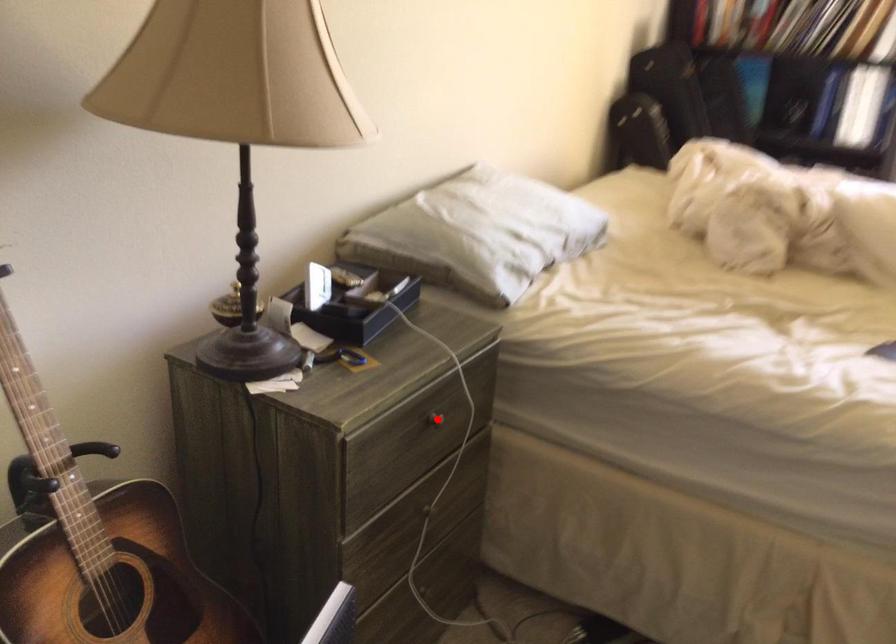
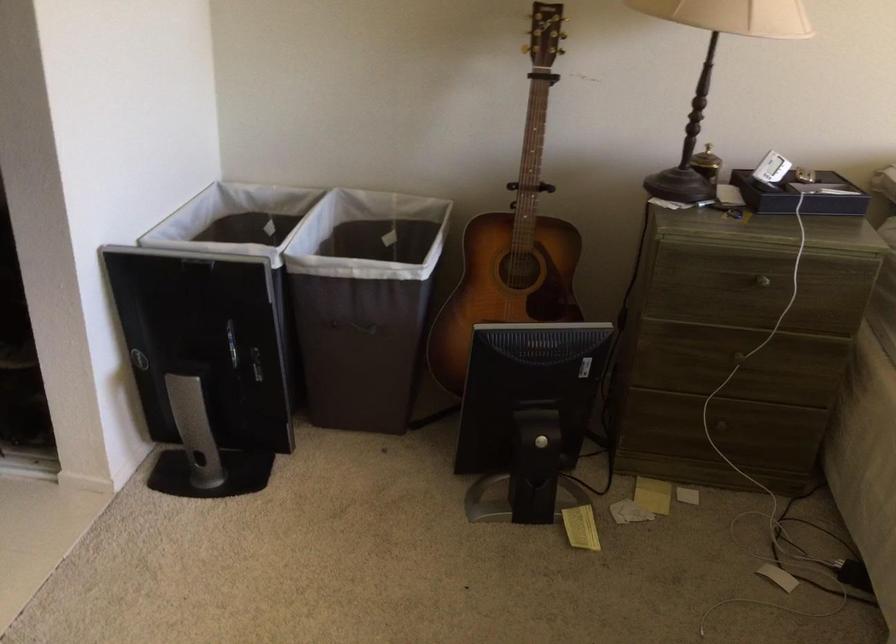
The point at the highlighted location is marked in the first image. Where is the corresponding point in the second image?

(762, 281)